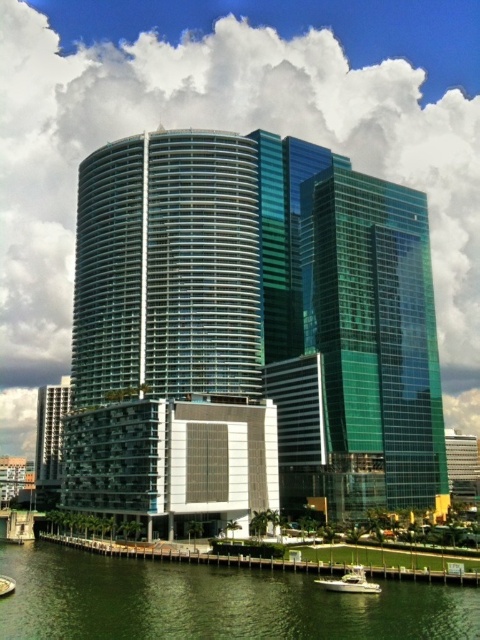
Is green water at lower center to the right of green wooden dock at lower center from the viewer's perspective?

No, green water at lower center is not to the right of green wooden dock at lower center.

Can you confirm if green water at lower center is wider than green wooden dock at lower center?

Correct, the width of green water at lower center exceeds that of green wooden dock at lower center.

The image size is (480, 640). Find the location of `green water at lower center`. green water at lower center is located at coordinates (212, 602).

Can you confirm if green wooden dock at lower center is positioned below white glossy boat at lower center?

Indeed, green wooden dock at lower center is positioned under white glossy boat at lower center.

Is green wooden dock at lower center shorter than white glossy boat at lower center?

Incorrect, green wooden dock at lower center's height does not fall short of white glossy boat at lower center's.

Identify the location of green wooden dock at lower center. (192, 556).

The image size is (480, 640). Find the location of `green wooden dock at lower center`. green wooden dock at lower center is located at coordinates (192, 556).

Which is more to the left, shiny glass skyscraper at center or green wooden dock at lower center?

Positioned to the left is green wooden dock at lower center.

Does shiny glass skyscraper at center have a lesser width compared to green wooden dock at lower center?

In fact, shiny glass skyscraper at center might be wider than green wooden dock at lower center.

What do you see at coordinates (250, 332) in the screenshot?
I see `shiny glass skyscraper at center` at bounding box center [250, 332].

Image resolution: width=480 pixels, height=640 pixels. Identify the location of shiny glass skyscraper at center. coord(250,332).